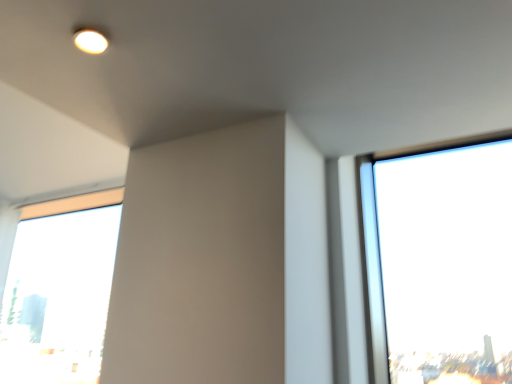
I want to click on transparent glass window at lower left, so [59, 290].

Describe the element at coordinates (59, 290) in the screenshot. The image size is (512, 384). I see `transparent glass window at lower left` at that location.

In order to click on matte white light fixture at upper left in this screenshot , I will do `click(90, 41)`.

What do you see at coordinates (90, 41) in the screenshot?
I see `matte white light fixture at upper left` at bounding box center [90, 41].

The width and height of the screenshot is (512, 384). Identify the location of transparent glass window at lower left. (59, 290).

Considering the relative positions of transparent glass window at lower left and matte white light fixture at upper left in the image provided, is transparent glass window at lower left to the left of matte white light fixture at upper left from the viewer's perspective?

Correct, you'll find transparent glass window at lower left to the left of matte white light fixture at upper left.

Is transparent glass window at lower left behind matte white light fixture at upper left?

Yes, it is behind matte white light fixture at upper left.

Considering the positions of point (103, 312) and point (106, 42), is point (103, 312) closer or farther from the camera than point (106, 42)?

Point (103, 312) is farther from the camera than point (106, 42).

From the image's perspective, is transparent glass window at lower left above matte white light fixture at upper left?

No, from the image's perspective, transparent glass window at lower left is not over matte white light fixture at upper left.

From a real-world perspective, is transparent glass window at lower left physically located above or below matte white light fixture at upper left?

From a real-world perspective, transparent glass window at lower left is physically below matte white light fixture at upper left.

Considering the sizes of objects transparent glass window at lower left and matte white light fixture at upper left in the image provided, who is wider, transparent glass window at lower left or matte white light fixture at upper left?

With larger width is transparent glass window at lower left.

In terms of height, does transparent glass window at lower left look taller or shorter compared to matte white light fixture at upper left?

Clearly, transparent glass window at lower left is taller compared to matte white light fixture at upper left.

Which of these two, transparent glass window at lower left or matte white light fixture at upper left, is smaller?

Smaller between the two is matte white light fixture at upper left.

Would you say matte white light fixture at upper left is part of transparent glass window at lower left's contents?

No, transparent glass window at lower left does not contain matte white light fixture at upper left.

Are transparent glass window at lower left and matte white light fixture at upper left beside each other?

transparent glass window at lower left is not next to matte white light fixture at upper left, and they're not touching.

In the scene shown: Is transparent glass window at lower left facing towards matte white light fixture at upper left?

No, transparent glass window at lower left is not oriented towards matte white light fixture at upper left.

Can you tell me how much transparent glass window at lower left and matte white light fixture at upper left differ in facing direction?

transparent glass window at lower left and matte white light fixture at upper left are facing 1.47 degrees away from each other.

Where is `window below the matte white light fixture at upper left (from the image's perspective)`? The width and height of the screenshot is (512, 384). window below the matte white light fixture at upper left (from the image's perspective) is located at coordinates (59, 290).

Considering the relative positions of matte white light fixture at upper left and transparent glass window at lower left in the image provided, is matte white light fixture at upper left to the right of transparent glass window at lower left from the viewer's perspective?

Yes, matte white light fixture at upper left is to the right of transparent glass window at lower left.

Between matte white light fixture at upper left and transparent glass window at lower left, which one is positioned behind?

transparent glass window at lower left is more distant.

Between point (94, 31) and point (31, 232), which one is positioned behind?

Positioned behind is point (31, 232).

From the image's perspective, does matte white light fixture at upper left appear higher than transparent glass window at lower left?

Yes, from the image's perspective, matte white light fixture at upper left is on top of transparent glass window at lower left.

From a real-world perspective, is matte white light fixture at upper left located higher than transparent glass window at lower left?

Yes, from a real-world perspective, matte white light fixture at upper left is on top of transparent glass window at lower left.

Can you confirm if matte white light fixture at upper left is wider than transparent glass window at lower left?

No.

Can you confirm if matte white light fixture at upper left is taller than transparent glass window at lower left?

Incorrect, the height of matte white light fixture at upper left is not larger of that of transparent glass window at lower left.

Consider the image. Considering the sizes of objects matte white light fixture at upper left and transparent glass window at lower left in the image provided, who is smaller, matte white light fixture at upper left or transparent glass window at lower left?

matte white light fixture at upper left.

Is matte white light fixture at upper left situated inside transparent glass window at lower left or outside?

matte white light fixture at upper left is located beyond the bounds of transparent glass window at lower left.

Is matte white light fixture at upper left not close to transparent glass window at lower left?

Indeed, matte white light fixture at upper left is not near transparent glass window at lower left.

From the picture: Is matte white light fixture at upper left oriented towards transparent glass window at lower left?

No, matte white light fixture at upper left is not turned towards transparent glass window at lower left.

What's the angular difference between matte white light fixture at upper left and transparent glass window at lower left's facing directions?

The angular difference between matte white light fixture at upper left and transparent glass window at lower left is 1.47 degrees.

Could you measure the distance between matte white light fixture at upper left and transparent glass window at lower left?

They are 2.30 meters apart.

Where is `window that appears on the left of matte white light fixture at upper left`? This screenshot has width=512, height=384. window that appears on the left of matte white light fixture at upper left is located at coordinates (59, 290).

Locate an element on the screen. lighting above the transparent glass window at lower left (from the image's perspective) is located at coordinates [x=90, y=41].

Where is `lighting above the transparent glass window at lower left (from a real-world perspective)`? The height and width of the screenshot is (384, 512). lighting above the transparent glass window at lower left (from a real-world perspective) is located at coordinates (90, 41).